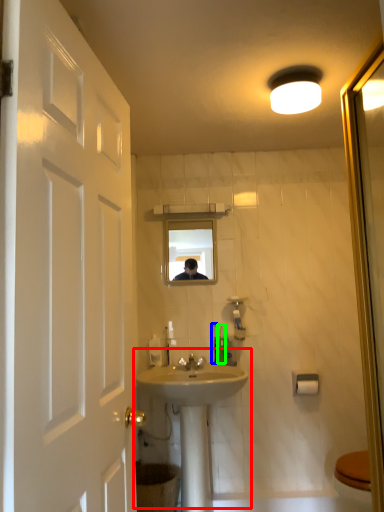
Question: Estimate the real-world distances between objects in this image. Which object is closer to sink (highlighted by a red box), toothbrush (highlighted by a blue box) or toiletry (highlighted by a green box)?

Choices:
 (A) toothbrush
 (B) toiletry

Answer: (B)